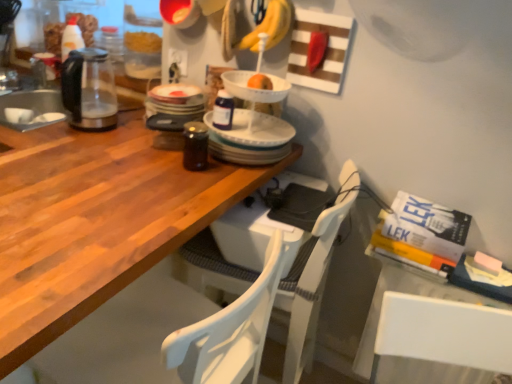
Question: Is the position of white plastic chair at center, acting as the second chair starting from the front, more distant than that of wooden table at center?

Choices:
 (A) no
 (B) yes

Answer: (B)

Question: Can you confirm if white plastic chair at center, which ranks as the first chair in back-to-front order, is taller than wooden table at center?

Choices:
 (A) yes
 (B) no

Answer: (A)

Question: Would you say white plastic chair at center, acting as the second chair starting from the front, is outside wooden table at center?

Choices:
 (A) yes
 (B) no

Answer: (B)

Question: Is the position of white plastic chair at center, acting as the second chair starting from the front, less distant than that of wooden table at center?

Choices:
 (A) yes
 (B) no

Answer: (B)

Question: Is white plastic chair at center, which ranks as the first chair in back-to-front order, wider than wooden table at center?

Choices:
 (A) no
 (B) yes

Answer: (A)

Question: From a real-world perspective, is white plastic chair at center, acting as the second chair starting from the front, above or below wooden table at center?

Choices:
 (A) below
 (B) above

Answer: (A)

Question: Considering their positions, is white plastic chair at center, which ranks as the first chair in back-to-front order, located in front of or behind wooden table at center?

Choices:
 (A) front
 (B) behind

Answer: (B)

Question: From the image's perspective, is white plastic chair at center, which ranks as the first chair in back-to-front order, above or below wooden table at center?

Choices:
 (A) above
 (B) below

Answer: (B)

Question: Visually, is white plastic chair at center, acting as the second chair starting from the front, positioned to the left or to the right of wooden table at center?

Choices:
 (A) left
 (B) right

Answer: (B)

Question: From the image's perspective, is yellow matte bananas at upper center positioned above or below white wood chair at lower left, acting as the second chair starting from the back?

Choices:
 (A) above
 (B) below

Answer: (A)

Question: In terms of height, does yellow matte bananas at upper center look taller or shorter compared to white wood chair at lower left, the 1th chair in the front-to-back sequence?

Choices:
 (A) short
 (B) tall

Answer: (A)

Question: Is yellow matte bananas at upper center bigger or smaller than white wood chair at lower left, acting as the second chair starting from the back?

Choices:
 (A) big
 (B) small

Answer: (B)

Question: In the image, is yellow matte bananas at upper center on the left side or the right side of white wood chair at lower left, the 1th chair in the front-to-back sequence?

Choices:
 (A) right
 (B) left

Answer: (A)

Question: From a real-world perspective, is white plastic chair at center, which ranks as the first chair in back-to-front order, positioned above or below transparent glass kettle at left?

Choices:
 (A) above
 (B) below

Answer: (B)

Question: Is white plastic chair at center, acting as the second chair starting from the front, wider or thinner than transparent glass kettle at left?

Choices:
 (A) wide
 (B) thin

Answer: (A)